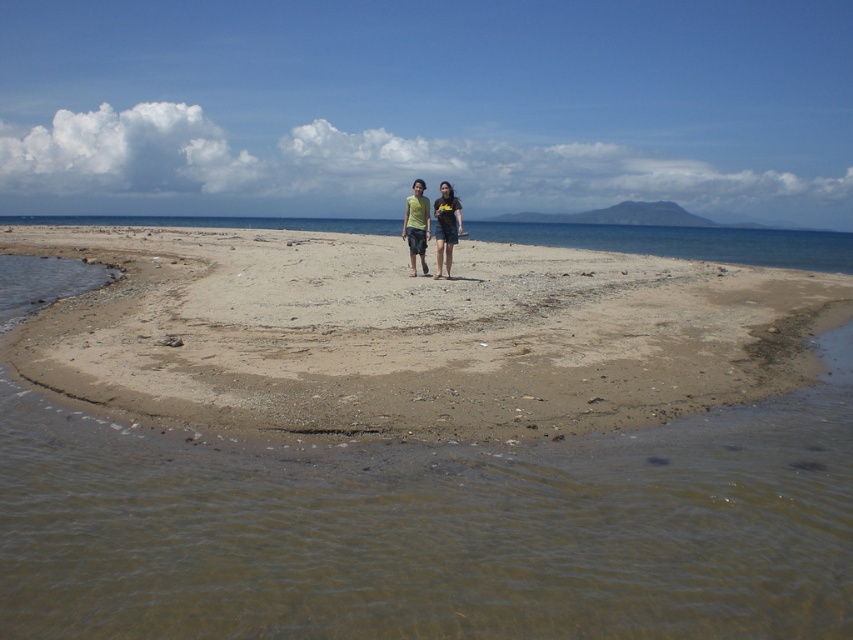
Between brown sandy beach at center and dark blue denim shorts at center, which one has more height?

Standing taller between the two is brown sandy beach at center.

Can you confirm if brown sandy beach at center is positioned to the right of dark blue denim shorts at center?

No, brown sandy beach at center is not to the right of dark blue denim shorts at center.

Is point (373, 326) positioned behind point (448, 212)?

No, it is not.

You are a GUI agent. You are given a task and a screenshot of the screen. Output one action in this format:
    pyautogui.click(x=<x>, y=<y>)
    Task: Click on the brown sandy beach at center
    The image size is (853, 640).
    Given the screenshot: What is the action you would take?
    pyautogui.click(x=410, y=333)

Can you confirm if brown sandy beach at center is thinner than matte yellow t-shirt at center?

Incorrect, brown sandy beach at center's width is not less than matte yellow t-shirt at center's.

Who is positioned more to the left, brown sandy beach at center or matte yellow t-shirt at center?

brown sandy beach at center

Locate an element on the screen. This screenshot has width=853, height=640. brown sandy beach at center is located at coordinates tap(410, 333).

Looking at this image, which is above, matte green shirt at center or dark blue denim shorts at center?

dark blue denim shorts at center

Where is `matte green shirt at center`? Image resolution: width=853 pixels, height=640 pixels. matte green shirt at center is located at coordinates (416, 225).

Does point (408, 216) lie behind point (459, 230)?

No, (408, 216) is in front of (459, 230).

The height and width of the screenshot is (640, 853). I want to click on matte green shirt at center, so click(416, 225).